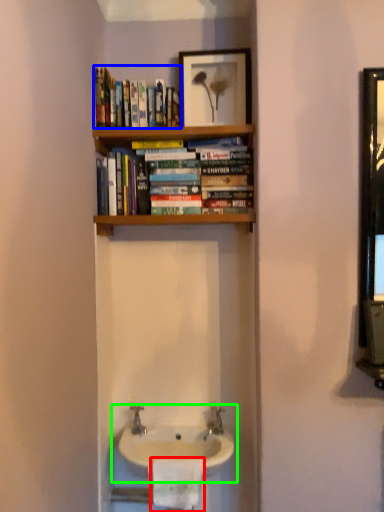
Question: Which is nearer to the toilet paper (highlighted by a red box)? book (highlighted by a blue box) or sink (highlighted by a green box).

Choices:
 (A) book
 (B) sink

Answer: (B)